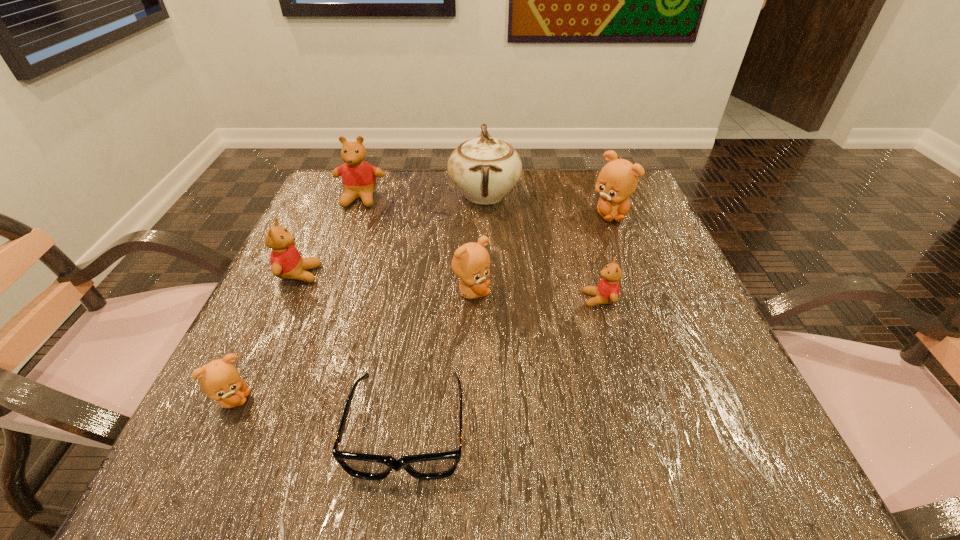
I want to click on blank space at the far left corner of the desktop, so click(x=379, y=192).

The width and height of the screenshot is (960, 540). Identify the location of vacant space at the near left corner. (239, 449).

In the image, there is a desktop. Identify the location of free space at the far right corner. This screenshot has width=960, height=540. (571, 171).

Locate an element on the screen. This screenshot has height=540, width=960. vacant area that lies between the farthest red teddy bear and the white chinaware is located at coordinates (422, 197).

The width and height of the screenshot is (960, 540). I want to click on vacant point located between the second smallest red teddy bear and the nearest brown teddy bear, so tap(266, 337).

At what (x,y) coordinates should I click in order to perform the action: click on free spot between the rightmost brown teddy bear and the second biggest red teddy bear. Please return your answer as a coordinate pair (x, y). Image resolution: width=960 pixels, height=540 pixels. Looking at the image, I should click on (454, 244).

Where is `vacant region between the rightmost brown teddy bear and the rightmost red teddy bear`? vacant region between the rightmost brown teddy bear and the rightmost red teddy bear is located at coordinates (605, 257).

Find the location of a particular element. The image size is (960, 540). vacant point located between the biggest brown teddy bear and the second smallest red teddy bear is located at coordinates (454, 244).

Image resolution: width=960 pixels, height=540 pixels. What are the coordinates of `vacant space in between the second biggest brown teddy bear and the smallest brown teddy bear` in the screenshot? It's located at (352, 346).

Identify the location of free space between the chinaware and the nearest teddy bear. This screenshot has width=960, height=540. (359, 297).